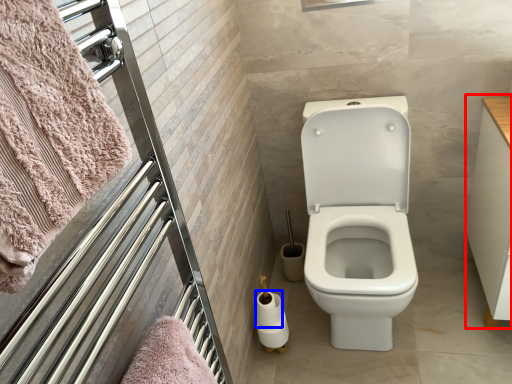
Question: Which object appears closest to the camera in this image, drawer (highlighted by a red box) or toilet paper (highlighted by a blue box)?

Choices:
 (A) drawer
 (B) toilet paper

Answer: (A)